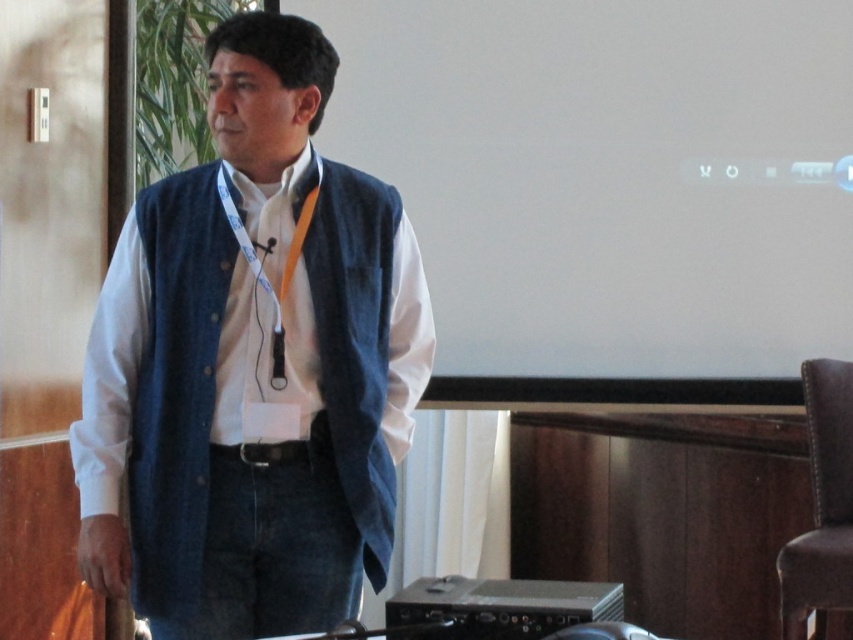
You are an attendee at a conference and need to look at the screen and your presenter. Where should you look to see both the white matte projection screen at upper center and the denim vest at center?

You should look to your left because the white matte projection screen at upper center is to the right of the denim vest at center, so by facing left, you can see both the screen and the presenter in the center.

You are an attendee at a conference and want to take a photo of the speaker. The speaker is wearing a denim vest at center and standing in front of a white matte projection screen at upper center. Will the speaker be clearly visible in your photo?

The denim vest at center is behind the white matte projection screen at upper center, so the speaker will not be clearly visible in the photo because the projection screen is blocking the view of the speaker.

You are an event planner setting up a presentation. You need to ensure that the white matte projection screen at upper center and the denim vest at center are visible to all attendees. Given that the projection screen is wider than the denim vest, which object should be placed closer to the front of the room to ensure visibility?

The denim vest at center should be placed closer to the front of the room since the white matte projection screen at upper center is already wider, making it more visible from a distance. Placing the smaller denim vest at center upfront ensures both objects are equally visible to attendees.